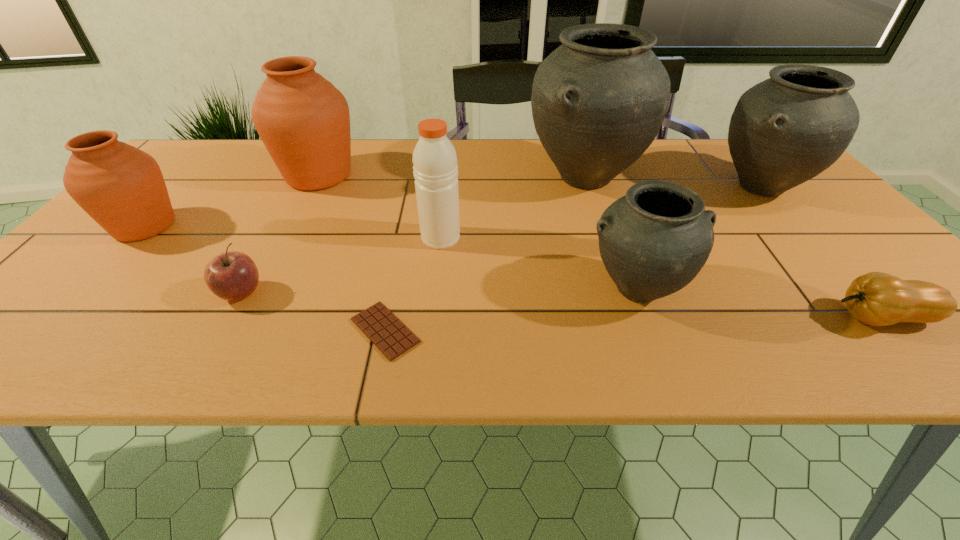
You are a GUI agent. You are given a task and a screenshot of the screen. Output one action in this format:
    pyautogui.click(x=<x>, y=<y>)
    Task: Click on the biggest black urn
    
    Given the screenshot: What is the action you would take?
    pyautogui.click(x=598, y=101)

Find the location of a particular element. the tallest urn is located at coordinates (598, 101).

You are a GUI agent. You are given a task and a screenshot of the screen. Output one action in this format:
    pyautogui.click(x=<x>, y=<y>)
    Task: Click on the bigger brown urn
    The image size is (960, 540).
    Given the screenshot: What is the action you would take?
    pyautogui.click(x=303, y=120)

Where is `the farther brown urn`? This screenshot has height=540, width=960. the farther brown urn is located at coordinates (303, 120).

Find the location of a particular element. This screenshot has height=540, width=960. the rightmost black urn is located at coordinates coord(785,130).

Find the location of `the rightmost urn`. the rightmost urn is located at coordinates (785, 130).

Locate an element on the screen. This screenshot has height=540, width=960. shaker is located at coordinates (435, 169).

The image size is (960, 540). Find the location of `the leftmost object`. the leftmost object is located at coordinates (121, 187).

Find the location of `the nearer brown urn`. the nearer brown urn is located at coordinates (121, 187).

The width and height of the screenshot is (960, 540). Identify the location of the nearest urn. (653, 241).